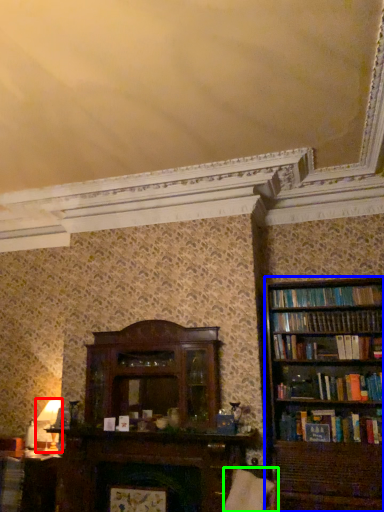
Question: Considering the real-world distances, which object is closest to table lamp (highlighted by a red box)? bookcase (highlighted by a blue box) or swivel chair (highlighted by a green box).

Choices:
 (A) bookcase
 (B) swivel chair

Answer: (B)